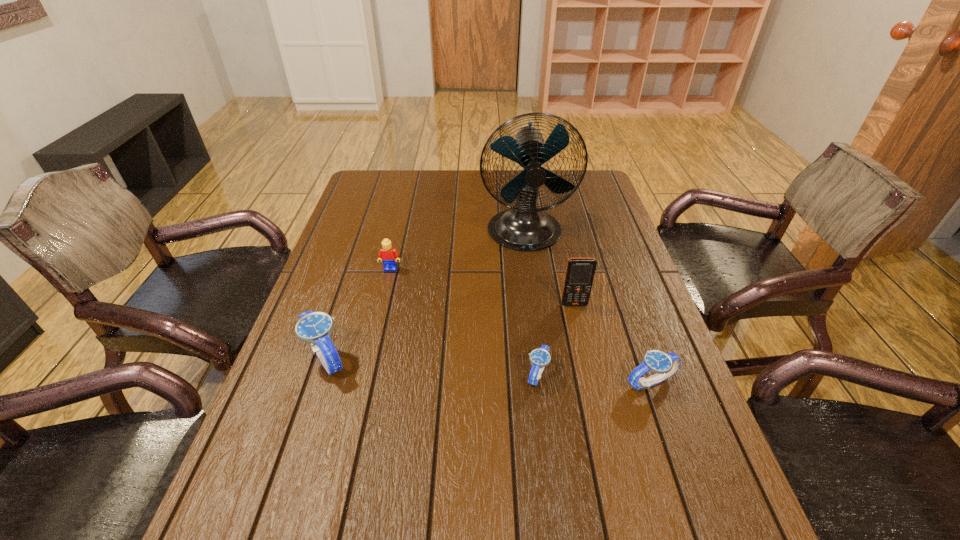
If we want them evenly spaced by inserting an extra watch among them, please locate a free spot for this new watch. Please provide its 2D coordinates. Your answer should be formatted as a tuple, i.e. [(x, y)], where the tuple contains the x and y coordinates of a point satisfying the conditions above.

[(430, 366)]